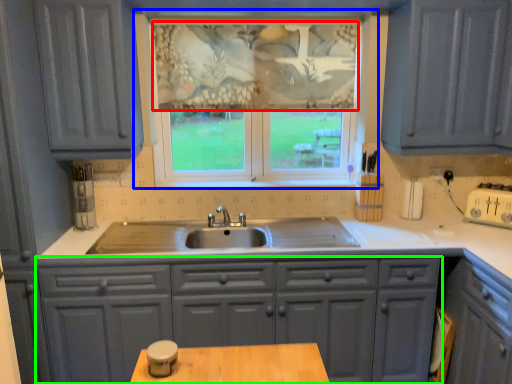
Question: Which object is the farthest from curtain (highlighted by a red box)? Choose among these: window (highlighted by a blue box) or cabinetry (highlighted by a green box).

Choices:
 (A) window
 (B) cabinetry

Answer: (B)